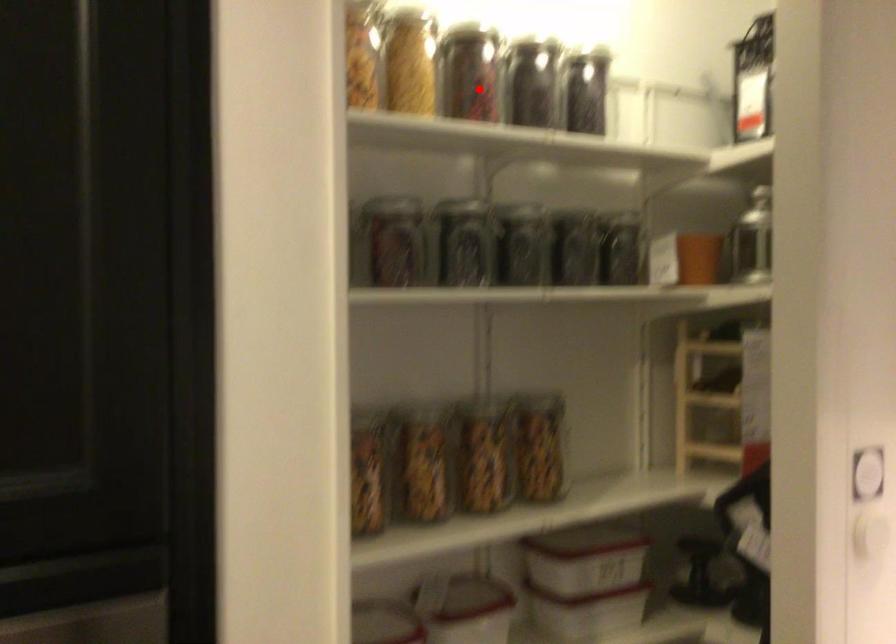
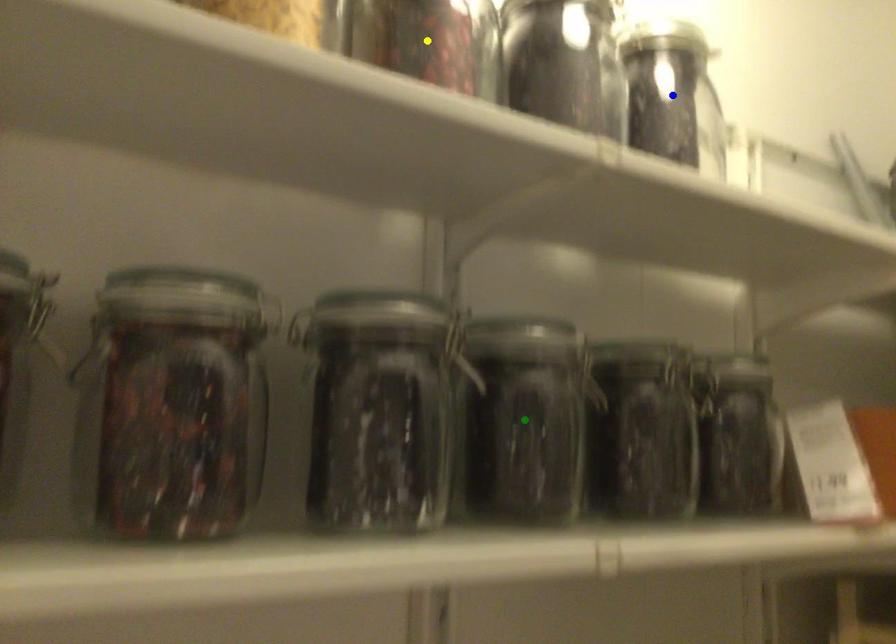
Question: I am providing you with two images of the same scene from different viewpoints. A red point is marked on the first image. You are given multiple points on the second image. Which mark in image 2 goes with the point in image 1?

Choices:
 (A) blue point
 (B) green point
 (C) yellow point

Answer: (C)